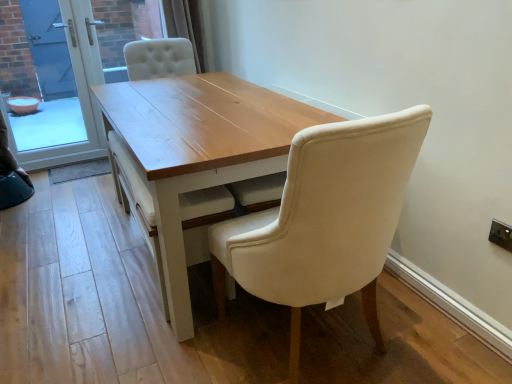
Question: From the image's perspective, is light wood table at center positioned above or below blue glass screen door at left, arranged as the first screen door when viewed from the left?

Choices:
 (A) below
 (B) above

Answer: (A)

Question: Considering the positions of light wood table at center and blue glass screen door at left, arranged as the first screen door when viewed from the left, in the image, is light wood table at center bigger or smaller than blue glass screen door at left, arranged as the first screen door when viewed from the left,?

Choices:
 (A) big
 (B) small

Answer: (A)

Question: Considering the real-world distances, which object is closest to the matte cream chair at center?

Choices:
 (A) blue glass screen door at left, arranged as the first screen door when viewed from the left
 (B) transparent glass screen door at upper left, which is the first screen door from right to left
 (C) white plastic electric outlet at upper right
 (D) tufted fabric curtain at upper center
 (E) light wood table at center

Answer: (E)

Question: Which is nearer to the matte cream chair at center?

Choices:
 (A) transparent glass screen door at upper left, arranged as the second screen door when viewed from the left
 (B) white plastic electric outlet at upper right
 (C) light wood table at center
 (D) tufted fabric curtain at upper center
 (E) blue glass screen door at left, arranged as the first screen door when viewed from the left

Answer: (C)